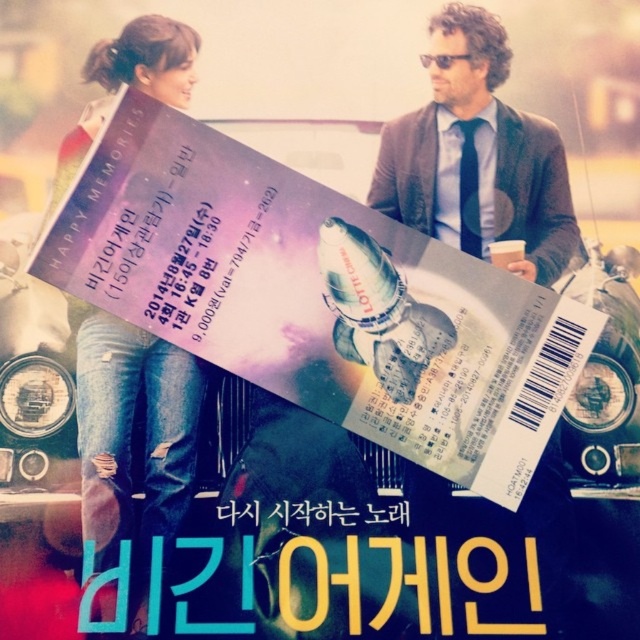
Question: Is jeans at left below dark gray sweater at upper right?

Choices:
 (A) no
 (B) yes

Answer: (B)

Question: Can you confirm if jeans at left is bigger than dark gray sweater at upper right?

Choices:
 (A) yes
 (B) no

Answer: (A)

Question: Among these points, which one is nearest to the camera?

Choices:
 (A) (100, 552)
 (B) (435, 212)

Answer: (A)

Question: Is the position of jeans at left more distant than that of dark gray sweater at upper right?

Choices:
 (A) yes
 (B) no

Answer: (B)

Question: Which point appears farthest from the camera in this image?

Choices:
 (A) (172, 534)
 (B) (508, 236)

Answer: (B)